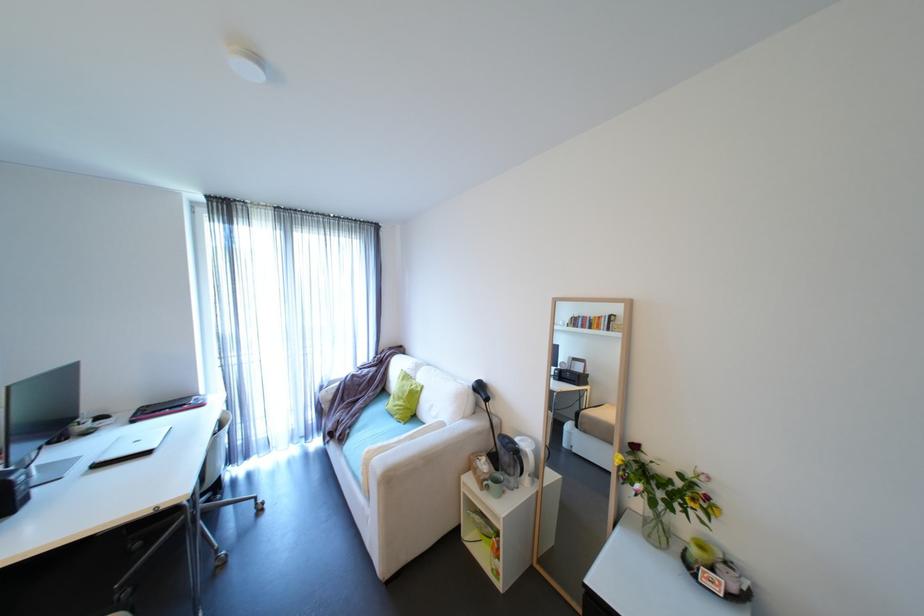
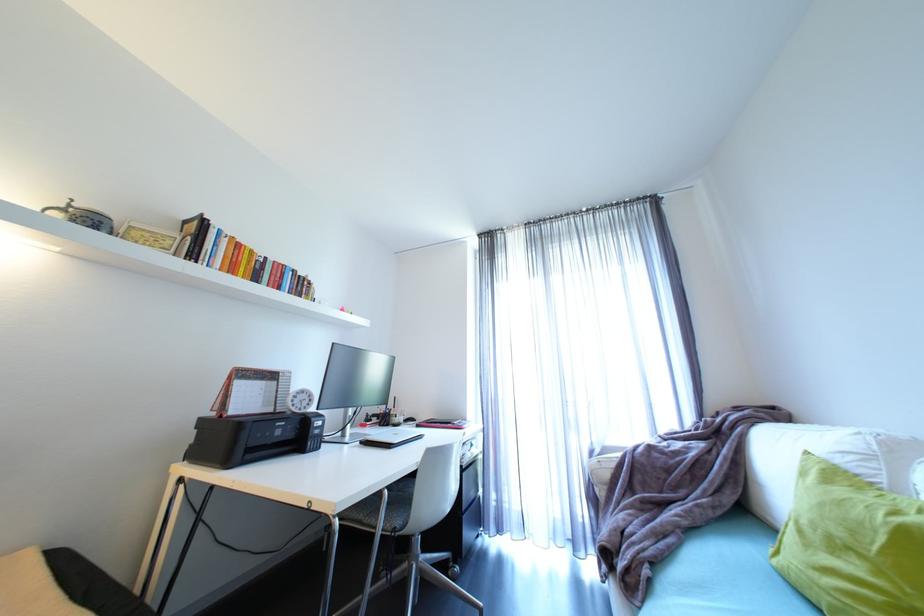
Locate, in the second image, the point that corresponds to the point at 165,413 in the first image.

(440, 424)